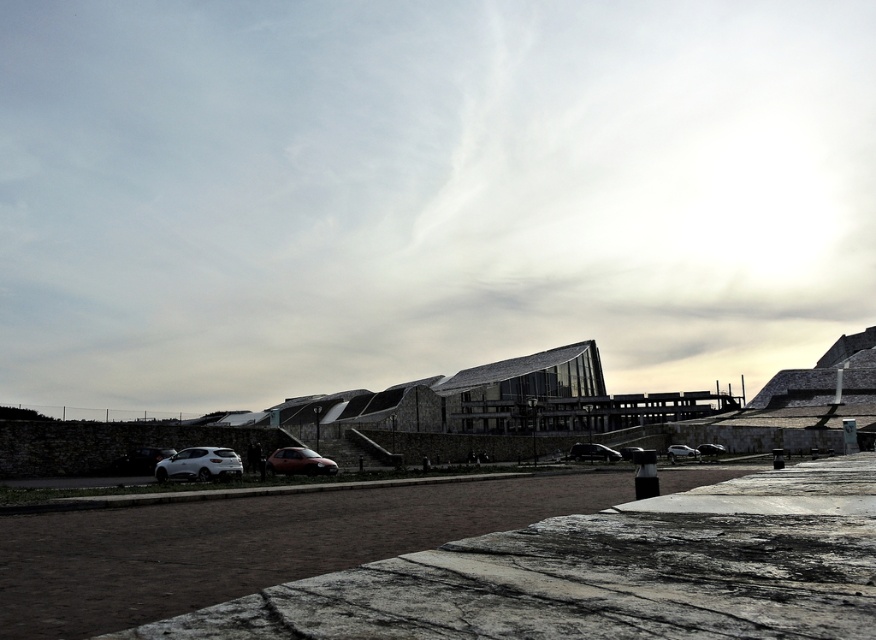
Question: Considering the real-world distances, which object is farthest from the matte black car at center?

Choices:
 (A) shiny silver car at center
 (B) white matte hatchback at lower left
 (C) matte silver sedan at center
 (D) matte red car at center

Answer: (B)

Question: Which point is farther from the camera taking this photo?

Choices:
 (A) 666,456
 (B) 309,449
 (C) 592,451

Answer: (A)

Question: Does shiny silver car at center have a smaller size compared to matte black car at center?

Choices:
 (A) yes
 (B) no

Answer: (A)

Question: Considering the real-world distances, which object is farthest from the white matte hatchback at lower left?

Choices:
 (A) matte red car at center
 (B) shiny silver car at center
 (C) matte black car at center
 (D) matte silver sedan at center

Answer: (C)

Question: Does matte red car at center have a greater width compared to shiny silver car at center?

Choices:
 (A) no
 (B) yes

Answer: (B)

Question: Is shiny silver car at center above matte silver sedan at center?

Choices:
 (A) yes
 (B) no

Answer: (A)